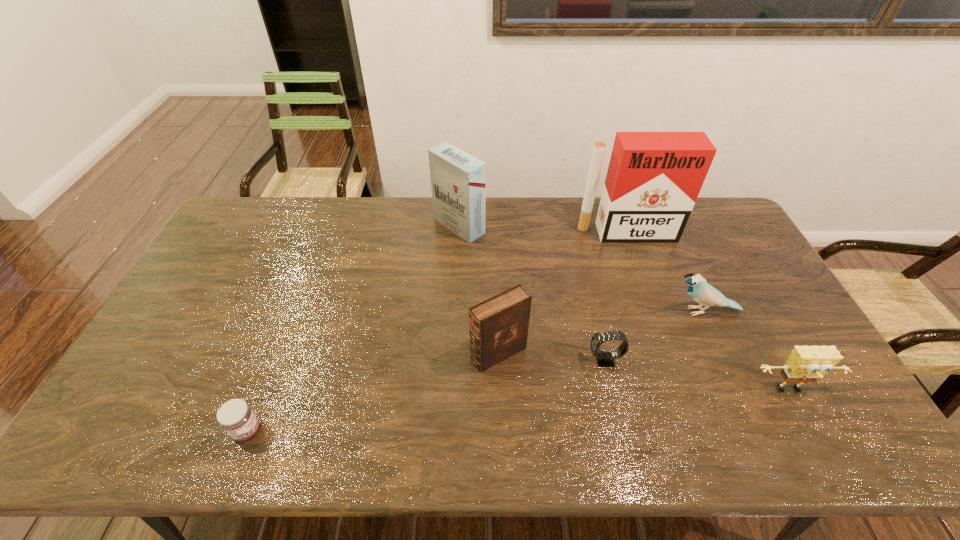
Where is `vacant space that's between the nearest object and the watch`? Image resolution: width=960 pixels, height=540 pixels. vacant space that's between the nearest object and the watch is located at coordinates (426, 396).

I want to click on free space that is in between the sixth farthest object and the shorter cigarette case, so click(x=625, y=309).

Find the location of `free space between the third tallest object and the shortest object`. free space between the third tallest object and the shortest object is located at coordinates (372, 393).

At what (x,y) coordinates should I click in order to perform the action: click on free space between the third tallest object and the watch. Please return your answer as a coordinate pair (x, y). Image resolution: width=960 pixels, height=540 pixels. Looking at the image, I should click on (552, 357).

Where is `empty location between the left cigarette case and the bird`? empty location between the left cigarette case and the bird is located at coordinates (582, 268).

At what (x,y) coordinates should I click in order to perform the action: click on free space between the second nearest object and the shorter cigarette case. Please return your answer as a coordinate pair (x, y). Looking at the image, I should click on (625, 309).

In order to click on free spot between the tallest object and the watch in this screenshot , I will do `click(615, 296)`.

The width and height of the screenshot is (960, 540). I want to click on unoccupied position between the shortest object and the watch, so click(426, 396).

This screenshot has height=540, width=960. I want to click on the fourth closest object to the watch, so click(x=653, y=180).

Image resolution: width=960 pixels, height=540 pixels. What are the coordinates of `object that is the second closest to the third tallest object` in the screenshot? It's located at (458, 180).